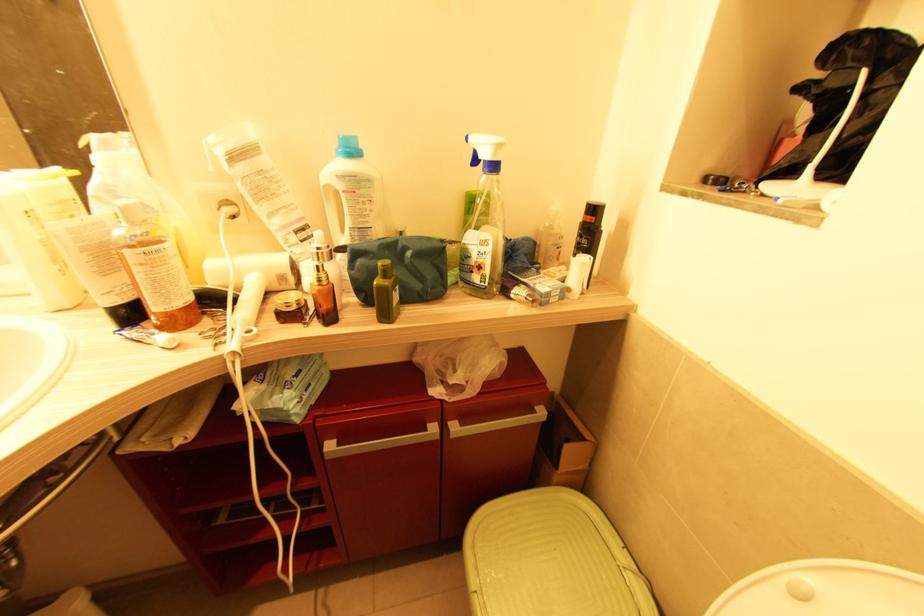
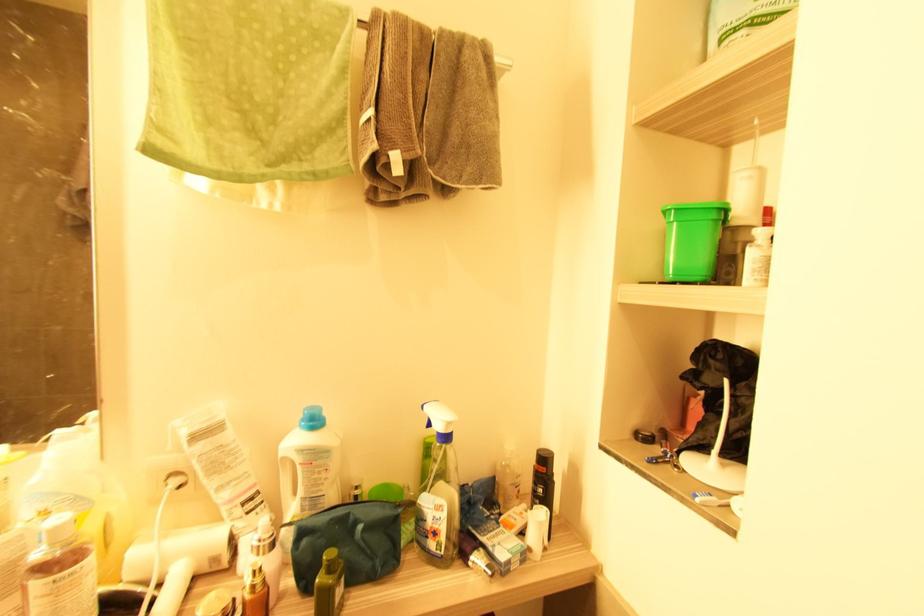
In the second image, find the point that corresponds to point (359, 192) in the first image.

(315, 464)